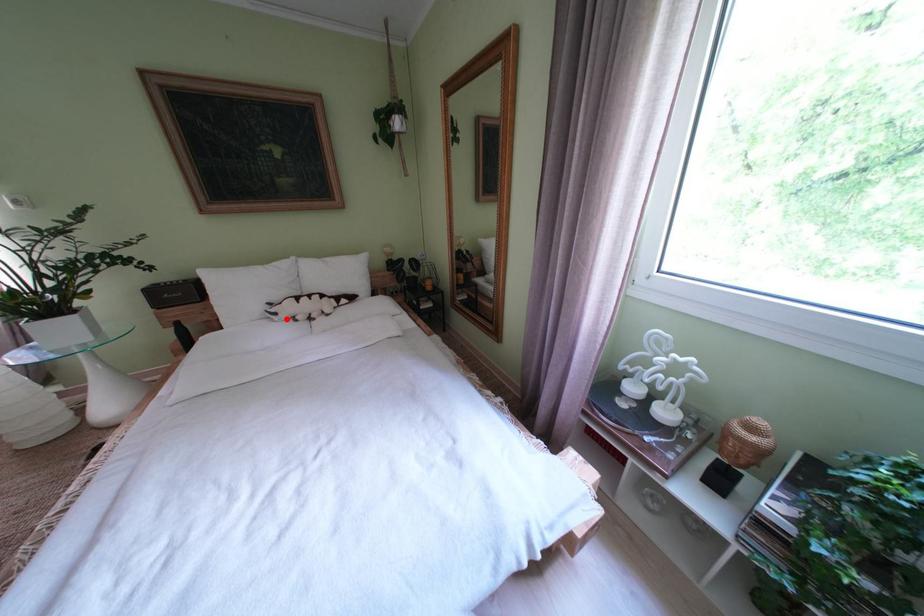
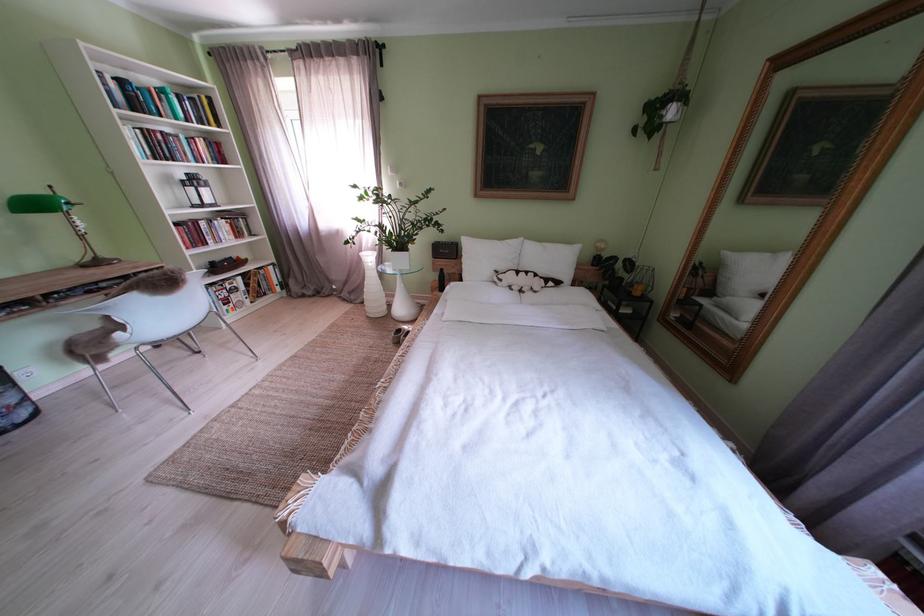
In the second image, find the point that corresponds to the highlighted location in the first image.

(512, 285)